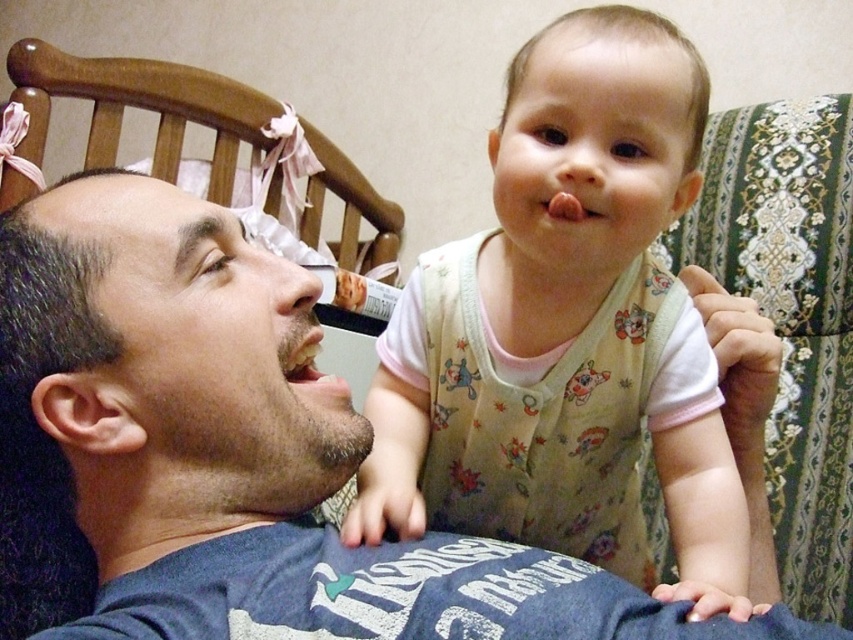
Question: Which object appears closest to the camera in this image?

Choices:
 (A) matte blue t-shirt at center
 (B) floral cotton onesie at center
 (C) smooth white teeth at center

Answer: (A)

Question: From the image, what is the correct spatial relationship of matte blue t-shirt at center in relation to floral cotton onesie at center?

Choices:
 (A) below
 (B) above

Answer: (B)

Question: Is matte blue t-shirt at center positioned at the back of smooth white teeth at center?

Choices:
 (A) no
 (B) yes

Answer: (A)

Question: Considering the real-world distances, which object is closest to the floral cotton onesie at center?

Choices:
 (A) smooth white teeth at center
 (B) matte blue t-shirt at center

Answer: (B)

Question: Does matte blue t-shirt at center come in front of smooth white teeth at center?

Choices:
 (A) yes
 (B) no

Answer: (A)

Question: Based on their relative distances, which object is nearer to the smooth white teeth at center?

Choices:
 (A) matte blue t-shirt at center
 (B) floral cotton onesie at center

Answer: (A)